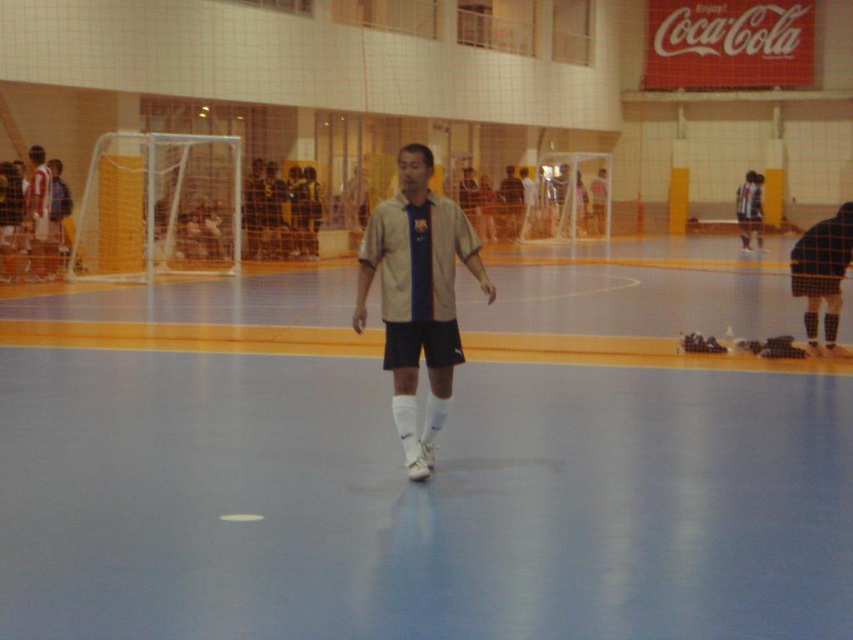
Is beige fabric shirt at center thinner than matte beige shirt at center?

Correct, beige fabric shirt at center's width is less than matte beige shirt at center's.

Which is in front, point (422, 444) or point (758, 180)?

Point (422, 444) is in front.

Who is more distant from viewer, (404, 444) or (741, 244)?

Positioned behind is point (741, 244).

You are a GUI agent. You are given a task and a screenshot of the screen. Output one action in this format:
    pyautogui.click(x=<x>, y=<y>)
    Task: Click on the beige fabric shirt at center
    Image resolution: width=853 pixels, height=640 pixels.
    Given the screenshot: What is the action you would take?
    pyautogui.click(x=416, y=296)

Is beige fabric shirt at center taller than dark blue checkered shorts at right?

No.

Is beige fabric shirt at center wider than dark blue checkered shorts at right?

No, beige fabric shirt at center is not wider than dark blue checkered shorts at right.

Is point (421, 310) positioned in front of point (831, 349)?

Yes, point (421, 310) is in front of point (831, 349).

Where is `beige fabric shirt at center`? The image size is (853, 640). beige fabric shirt at center is located at coordinates (416, 296).

Which is below, dark blue checkered shorts at right or matte white jersey at left?

matte white jersey at left is lower down.

Is point (822, 296) positioned in front of point (50, 193)?

Yes, it is.

Where is `dark blue checkered shorts at right`? The width and height of the screenshot is (853, 640). dark blue checkered shorts at right is located at coordinates (822, 272).